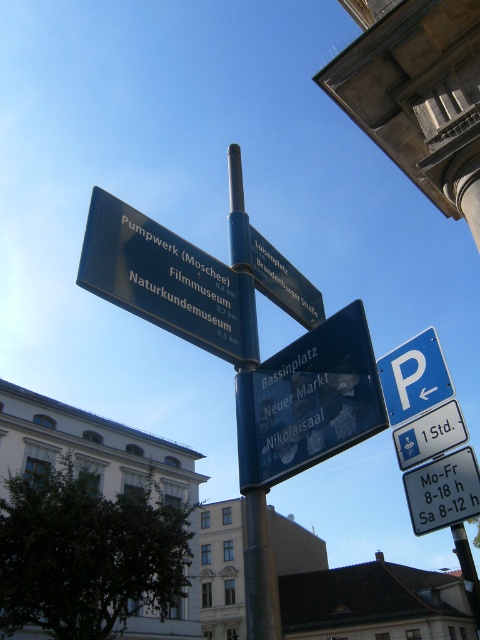
Between transparent plastic sign at center and blue plastic parking sign at upper right, which one is positioned lower?

blue plastic parking sign at upper right is lower down.

Between transparent plastic sign at center and blue plastic parking sign at upper right, which one is positioned higher?

transparent plastic sign at center is above.

Where is `transparent plastic sign at center`? This screenshot has width=480, height=640. transparent plastic sign at center is located at coordinates (309, 401).

Does point (237, 374) come in front of point (255, 560)?

No.

Can you confirm if transparent plastic sign at center is shorter than blue metallic pole at center?

Yes.

In order to click on transparent plastic sign at center in this screenshot , I will do `click(309, 401)`.

Does blue metallic pole at center appear on the right side of black plastic street sign at center?

No, blue metallic pole at center is not to the right of black plastic street sign at center.

Does blue metallic pole at center have a greater height compared to black plastic street sign at center?

Correct, blue metallic pole at center is much taller as black plastic street sign at center.

Is point (245, 592) farther from camera compared to point (280, 294)?

Yes, it is behind point (280, 294).

The width and height of the screenshot is (480, 640). I want to click on blue metallic pole at center, so click(x=243, y=317).